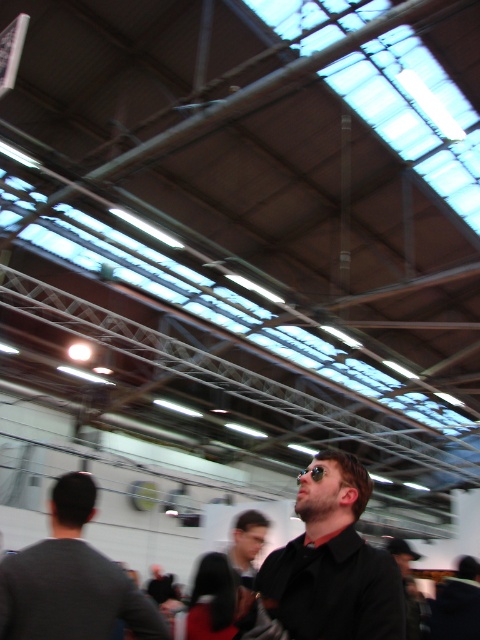
Question: Is black matte shirt at center bigger than gray fabric shirt at left?

Choices:
 (A) no
 (B) yes

Answer: (B)

Question: Is gray fabric shirt at left above dark brown leather jacket at center?

Choices:
 (A) no
 (B) yes

Answer: (B)

Question: Is gray fabric shirt at left thinner than dark brown leather jacket at center?

Choices:
 (A) yes
 (B) no

Answer: (B)

Question: Which point is farther to the camera?

Choices:
 (A) (297, 474)
 (B) (107, 560)

Answer: (A)

Question: Which object is positioned farthest from the sunglasses at center?

Choices:
 (A) dark brown leather jacket at center
 (B) gray fabric shirt at left

Answer: (A)

Question: Which of the following is the closest to the observer?

Choices:
 (A) (299, 480)
 (B) (232, 564)

Answer: (A)